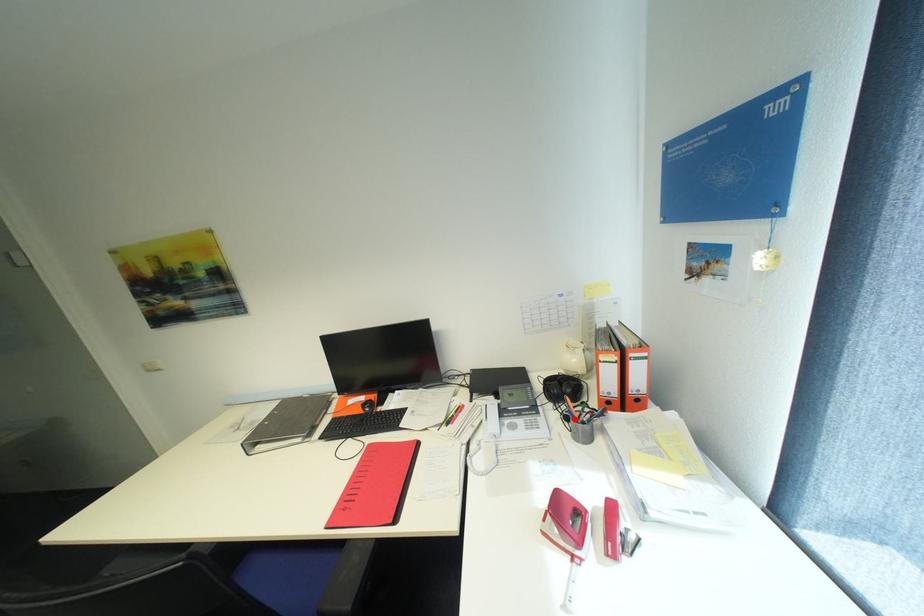
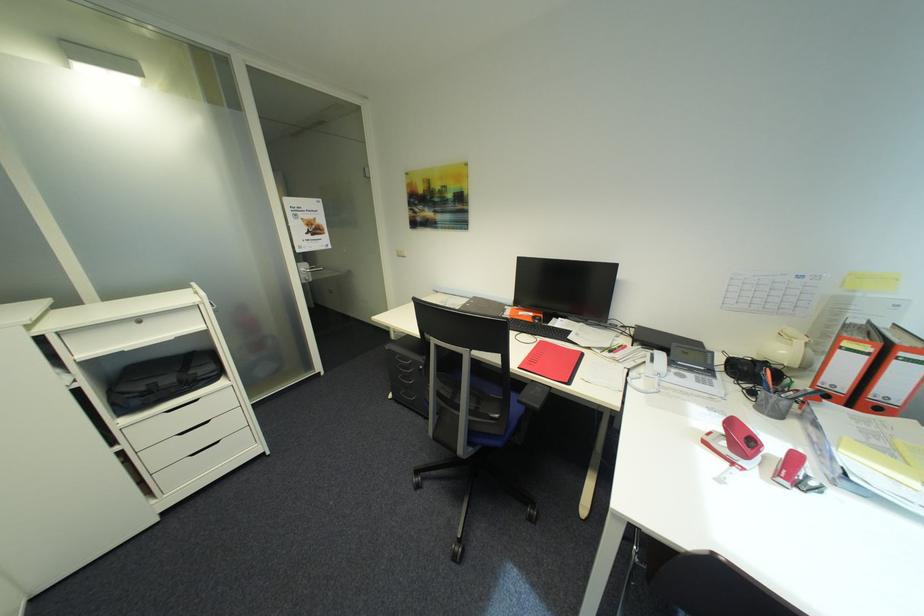
Locate, in the second image, the point that corresponds to the highlighted location in the first image.

(760, 392)